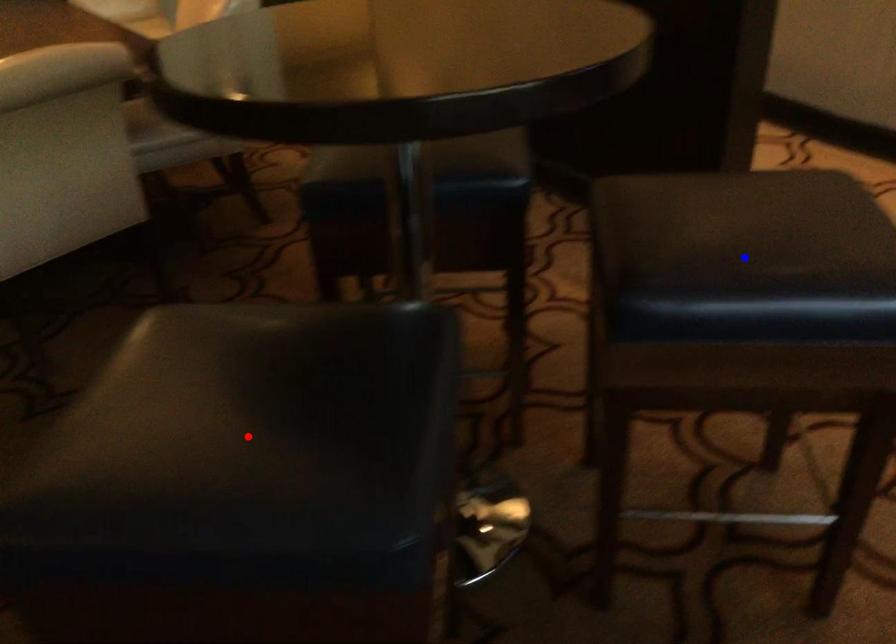
Question: In the image, two points are highlighted. Which point is nearer to the camera? Reply with the corresponding letter.

Choices:
 (A) blue point
 (B) red point

Answer: (B)